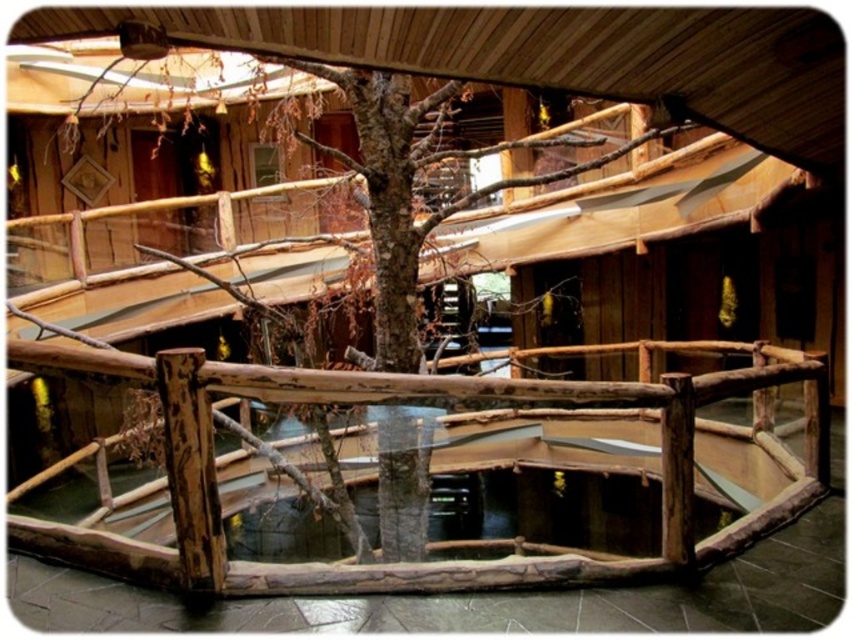
Question: Can you confirm if natural wood railing at center is positioned above brown rough wood tree at center?

Choices:
 (A) yes
 (B) no

Answer: (B)

Question: Is natural wood railing at center wider than brown rough wood tree at center?

Choices:
 (A) yes
 (B) no

Answer: (A)

Question: Which point is closer to the camera?

Choices:
 (A) natural wood railing at center
 (B) brown rough wood tree at center

Answer: (A)

Question: Which of the following is the closest to the observer?

Choices:
 (A) (766, 352)
 (B) (393, 104)

Answer: (B)

Question: Can you confirm if natural wood railing at center is positioned below brown rough wood tree at center?

Choices:
 (A) yes
 (B) no

Answer: (A)